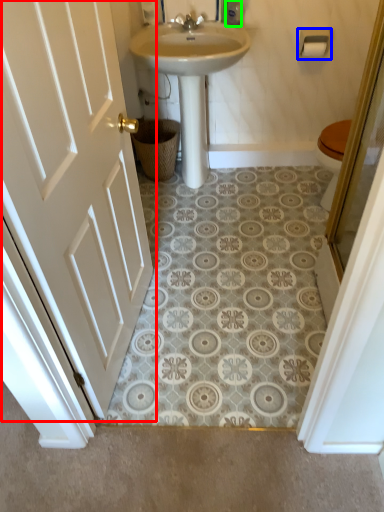
Question: Considering the real-world distances, which object is closest to door (highlighted by a red box)? towel bar (highlighted by a blue box) or toiletry (highlighted by a green box).

Choices:
 (A) towel bar
 (B) toiletry

Answer: (B)